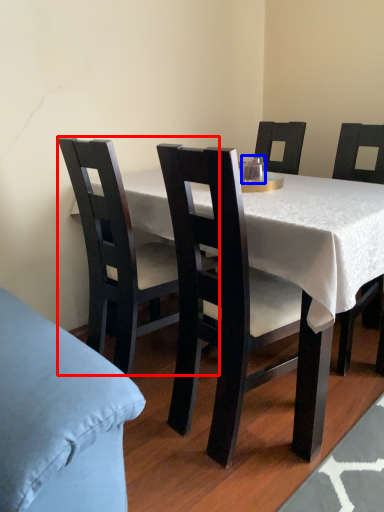
Question: Among these objects, which one is nearest to the camera, chair (highlighted by a red box) or coffee cup (highlighted by a blue box)?

Choices:
 (A) chair
 (B) coffee cup

Answer: (A)